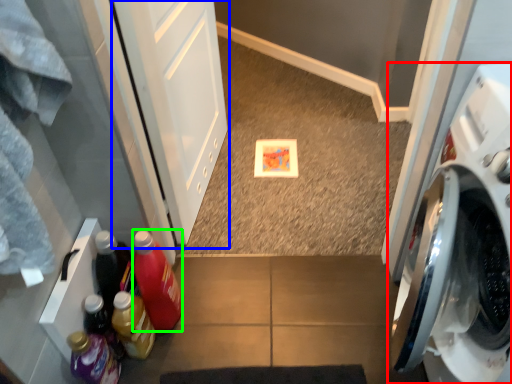
Question: Which object is positioned closest to washing machine (highlighted by a red box)? Select from screen door (highlighted by a blue box) and bottle (highlighted by a green box).

Choices:
 (A) screen door
 (B) bottle

Answer: (B)